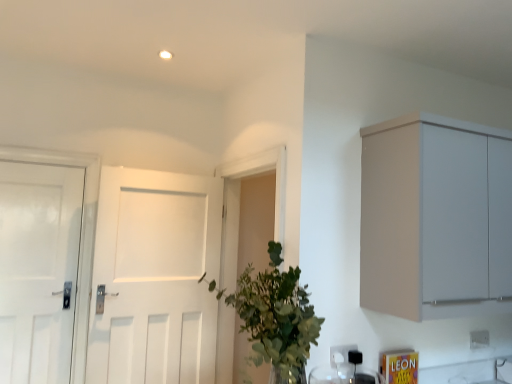
Question: Relative to white matte door at center, the first door when ordered from right to left, is green leafy plant at center in front or behind?

Choices:
 (A) front
 (B) behind

Answer: (A)

Question: From the image's perspective, is green leafy plant at center positioned above or below white matte door at center, the first door when ordered from right to left?

Choices:
 (A) above
 (B) below

Answer: (A)

Question: Which object is the closest to the white matte door at center, which ranks as the second door in left-to-right order?

Choices:
 (A) white matte door at left, which appears as the second door when viewed from the right
 (B) green leafy plant at center
 (C) white plastic electric outlet at lower right, which is counted as the first electric outlet, starting from the right
 (D) matte gray cabinet at upper right
 (E) white plastic electric outlet at lower center, which is the 1th electric outlet from front to back

Answer: (A)

Question: Which object is positioned farthest from the green leafy plant at center?

Choices:
 (A) white plastic electric outlet at lower right, the 2th electric outlet positioned from the left
 (B) white matte door at center, the first door when ordered from right to left
 (C) white matte door at left, which appears as the second door when viewed from the right
 (D) matte gray cabinet at upper right
 (E) white plastic electric outlet at lower center, the 2th electric outlet from the back

Answer: (C)